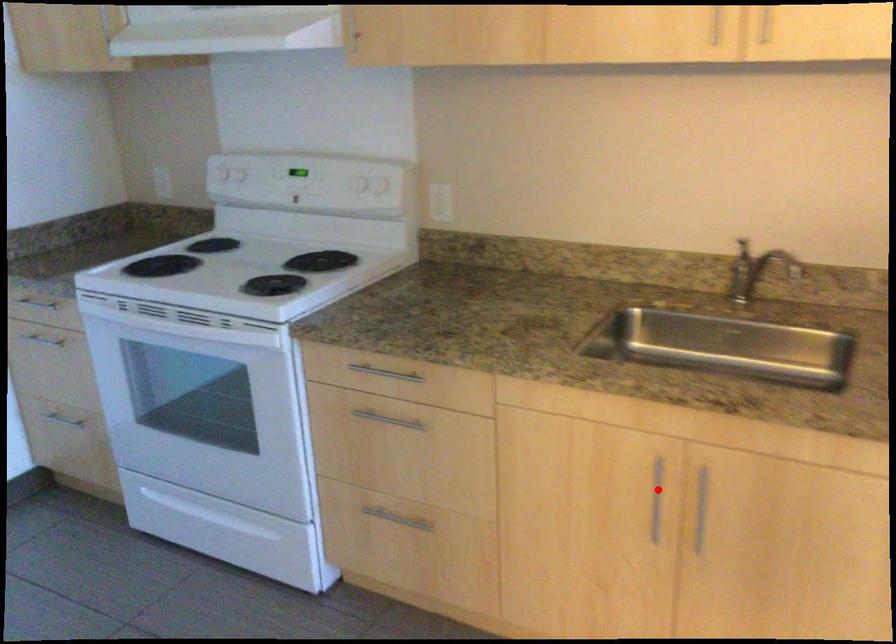
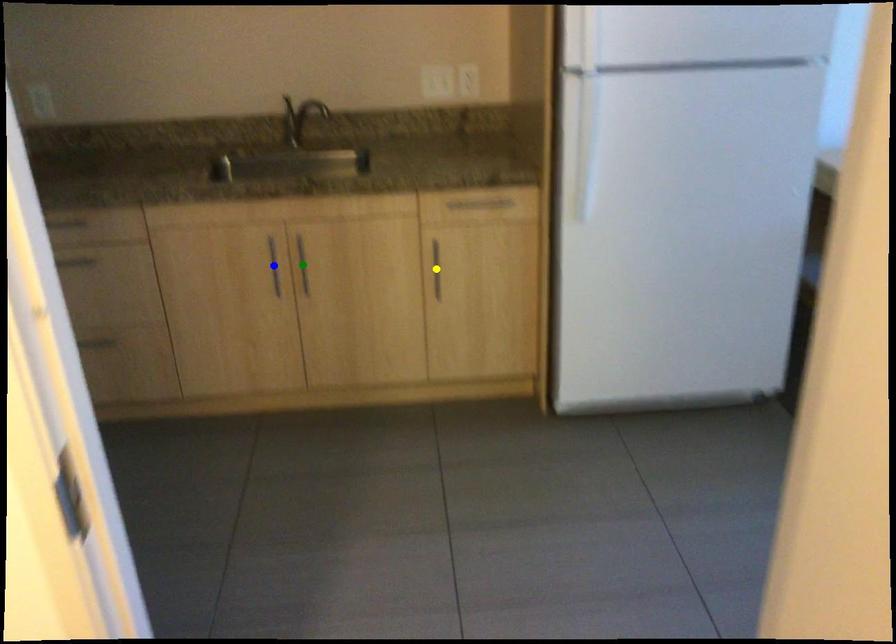
Question: I am providing you with two images of the same scene from different viewpoints. A red point is marked on the first image. You are given multiple points on the second image. Can you choose the point in image 2 that corresponds to the point in image 1?

Choices:
 (A) green point
 (B) blue point
 (C) yellow point

Answer: (B)